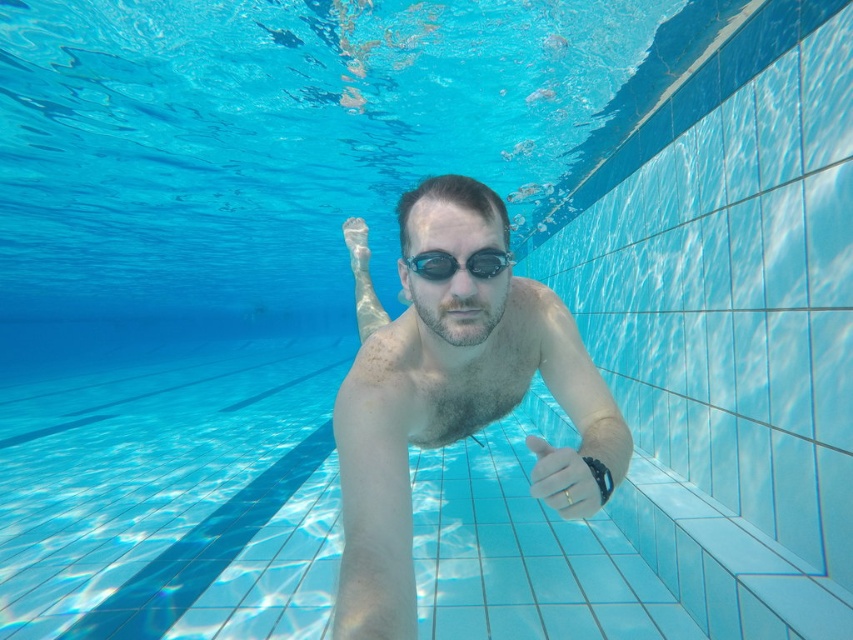
Question: Is smooth skin man at center to the left of transparent rubber goggles at center from the viewer's perspective?

Choices:
 (A) yes
 (B) no

Answer: (A)

Question: Among these objects, which one is farthest from the camera?

Choices:
 (A) white matte hand at center
 (B) transparent rubber goggles at center

Answer: (B)

Question: Can you confirm if smooth skin man at center is positioned below white matte hand at center?

Choices:
 (A) yes
 (B) no

Answer: (B)

Question: Does smooth skin man at center appear on the right side of white matte hand at center?

Choices:
 (A) yes
 (B) no

Answer: (B)

Question: Considering the real-world distances, which object is farthest from the transparent rubber goggles at center?

Choices:
 (A) smooth skin man at center
 (B) white matte hand at center

Answer: (A)

Question: Among these points, which one is farthest from the camera?

Choices:
 (A) 445,268
 (B) 583,467

Answer: (A)